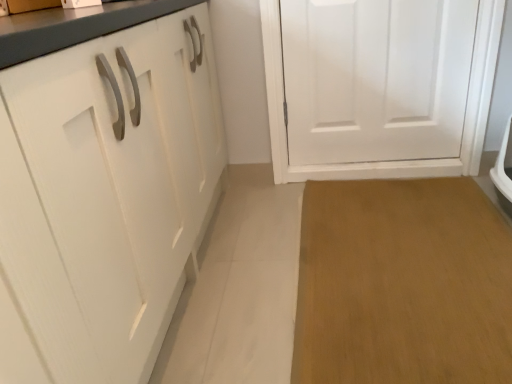
This screenshot has width=512, height=384. I want to click on vacant area on top of brown wood floor at lower right (from a real-world perspective), so click(431, 284).